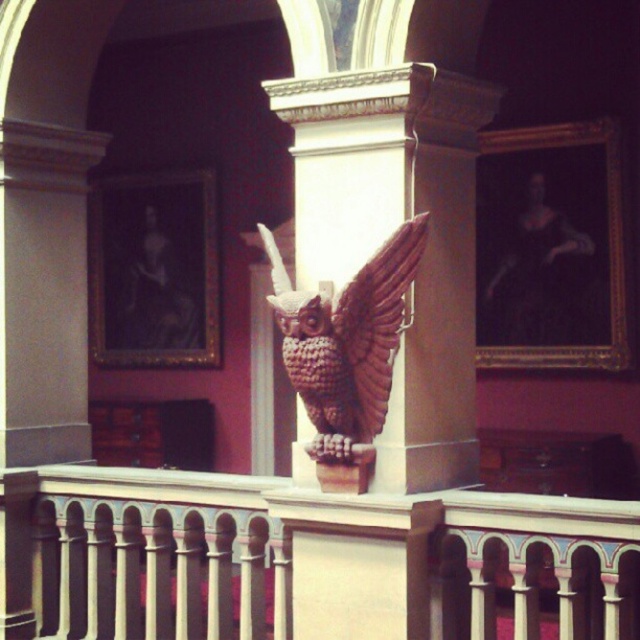
In the scene shown: Is brown carved owl at center positioned before wooden owl at center?

No, brown carved owl at center is further to the viewer.

Can you confirm if brown carved owl at center is wider than wooden owl at center?

Correct, the width of brown carved owl at center exceeds that of wooden owl at center.

Which is in front, point (336, 100) or point (316, 413)?

Positioned in front is point (316, 413).

Locate an element on the screen. The width and height of the screenshot is (640, 640). brown carved owl at center is located at coordinates point(388,234).

In the scene shown: Between white painted wood railing at center and wooden owl at center, which one appears on the left side from the viewer's perspective?

Positioned to the left is white painted wood railing at center.

Who is more forward, (68, 579) or (328, 349)?

Point (328, 349)

Between point (164, 481) and point (348, 372), which one is positioned in front?

Point (348, 372)

Where is `white painted wood railing at center`? This screenshot has width=640, height=640. white painted wood railing at center is located at coordinates (300, 560).

Which of these two, white painted wood railing at center or brown carved owl at center, stands taller?

brown carved owl at center is taller.

From the picture: Is white painted wood railing at center further to the viewer compared to brown carved owl at center?

No, white painted wood railing at center is closer to the viewer.

Which is in front, point (330, 536) or point (420, 387)?

Point (420, 387) is more forward.

This screenshot has width=640, height=640. Find the location of `white painted wood railing at center`. white painted wood railing at center is located at coordinates (300, 560).